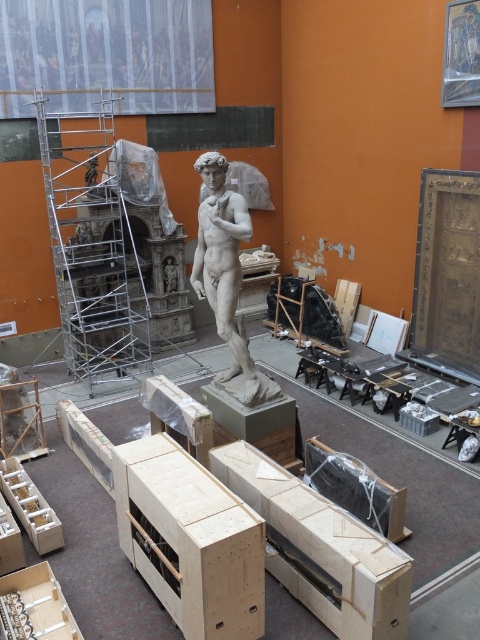
You are an art conservator working in the museum. You need to access the statue of David for restoration. There are several obstacles in the way. Which object is located at the coordinate point (x=93, y=246) that you need to move first?

The point at coordinate (x=93, y=246) corresponds to the silver metallic scaffolding at left, so you need to move the silver metallic scaffolding at left first.

Based on the photo, you are an art restorer working in the gallery. You need to move a large painting that is 3 meters wide through the space between the silver metallic scaffolding at left and the white marble statue at center. Can you fit it through without damaging either the painting or the objects?

Answer: The silver metallic scaffolding at left is wider than the white marble statue at center. The space between them may not be wide enough to accommodate a 3 meter wide painting without risking damage. You should check the exact dimensions before attempting to move it.

You are an art conservator working in the museum. You need to move a large painting from the entrance to the storage room. The path requires passing between the silver metallic scaffolding at left and the white marble statue at center. Is there enough vertical clearance to move the painting upright without hitting the scaffolding?

The silver metallic scaffolding at left is located above the white marble statue at center, so there is sufficient vertical clearance to move the painting upright between them without hitting the scaffolding.